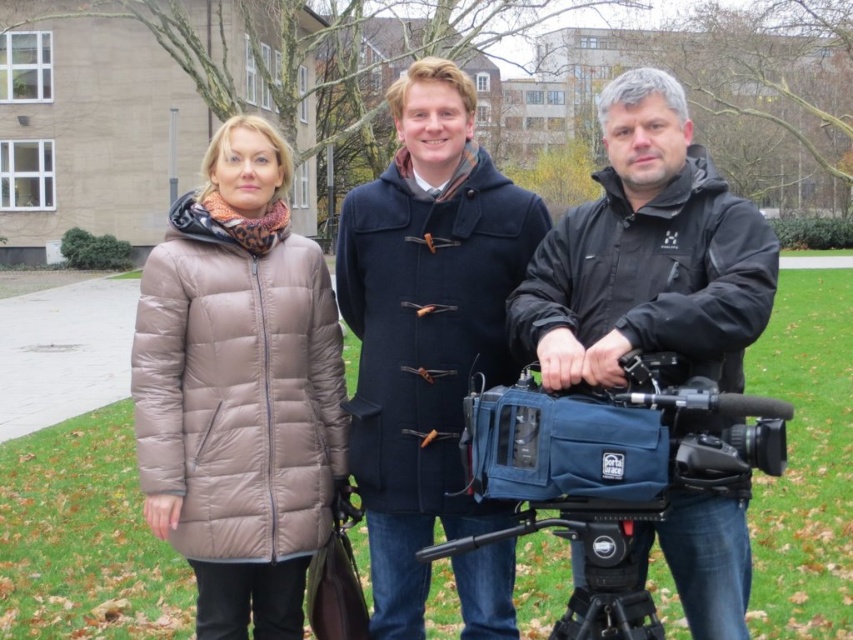
Question: Estimate the real-world distances between objects in this image. Which object is closer to the matte brown coat at center?

Choices:
 (A) matte brown puffer jacket at left
 (B) blue fabric camera at center
 (C) black softshell jacket at center

Answer: (B)

Question: Can you confirm if blue fabric video camera at lower right is positioned to the right of black plastic tripod at lower center?

Choices:
 (A) no
 (B) yes

Answer: (B)

Question: Can you confirm if matte brown puffer jacket at left is bigger than blue fabric video camera at lower right?

Choices:
 (A) no
 (B) yes

Answer: (A)

Question: Is matte brown puffer jacket at left below blue fabric camera at center?

Choices:
 (A) no
 (B) yes

Answer: (A)

Question: Which object is the closest to the navy wool coat at center?

Choices:
 (A) blue fabric video camera at lower right
 (B) matte brown puffer jacket at left
 (C) black plastic tripod at lower center

Answer: (C)

Question: Which point is farther to the camera?

Choices:
 (A) (582, 444)
 (B) (618, 240)
 (C) (408, 552)
 (D) (225, 220)

Answer: (C)